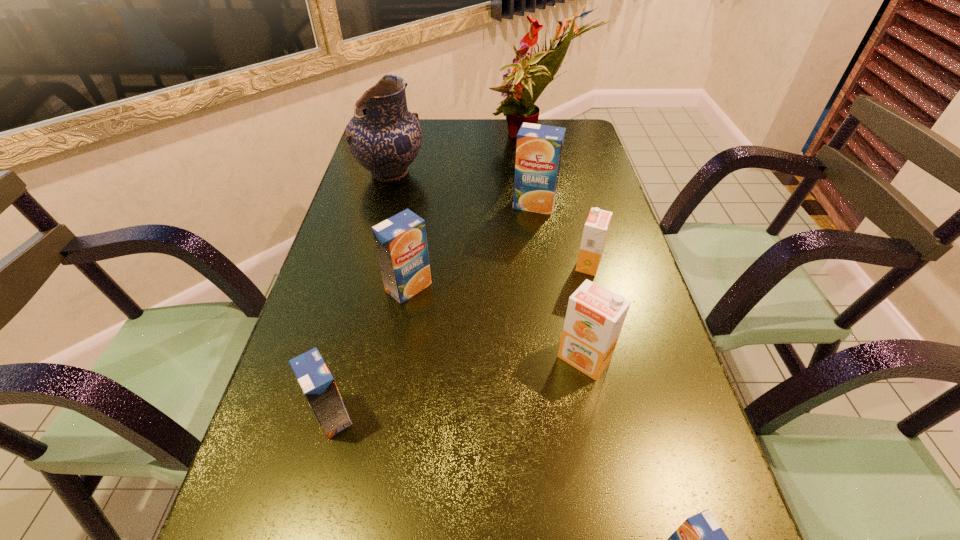
I want to click on blue orange_juice that is the second closest to the nearest object, so click(401, 243).

This screenshot has width=960, height=540. Find the location of `free space that satisfies the following two spatial constraints: 1. on the front-facing side of the bouquet; 2. on the right side of the sixth farthest object`. free space that satisfies the following two spatial constraints: 1. on the front-facing side of the bouquet; 2. on the right side of the sixth farthest object is located at coordinates (576, 359).

This screenshot has width=960, height=540. I want to click on vacant point that satisfies the following two spatial constraints: 1. on the back side of the second nearest orange_juice; 2. on the left side of the tallest orange_juice, so click(386, 205).